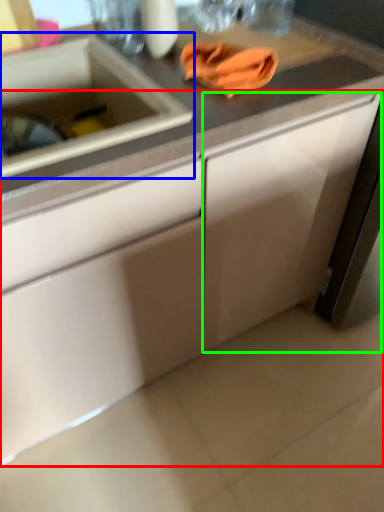
Question: Estimate the real-world distances between objects in this image. Which object is farther from cabinetry (highlighted by a red box), sink (highlighted by a blue box) or cabinetry (highlighted by a green box)?

Choices:
 (A) sink
 (B) cabinetry

Answer: (A)